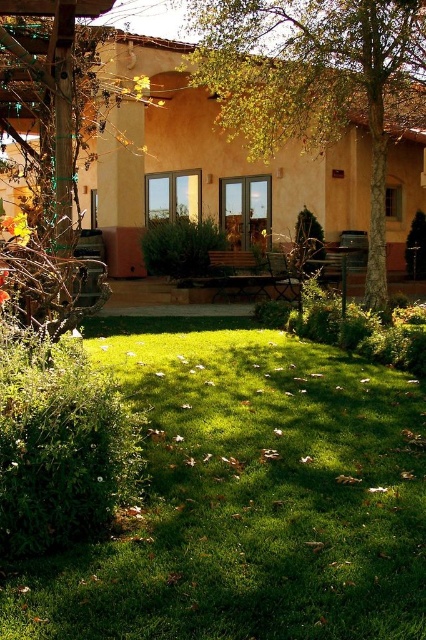
You are standing in the garden and want to walk from point A to point B. Point A is at coordinate point(227,72) and point B is at coordinate point(46,20). Which direction should you move to get from point A to point B?

To move from point A at coordinate point(227,72) to point B at coordinate point(46,20), you should move downward and to the left since point B is located lower and further to the left compared to point A.

You are a landscape architect designing a walking path between the brown textured tree at center and the brown textured tree at left. What is the minimum width the path should be to allow a standard garden cart to pass through comfortably?

The distance between the brown textured tree at center and the brown textured tree at left is 5.63 meters. A standard garden cart typically requires a path width of at least 1.2 meters. Since the existing space between the trees is significantly wider than this requirement, the path can easily accommodate the garden cart without any adjustments needed.

You are standing in the garden looking at the green grass at center and the brown textured tree at center. Which object is closer to the ground?

The green grass at center is closer to the ground because it is located below the brown textured tree at center.